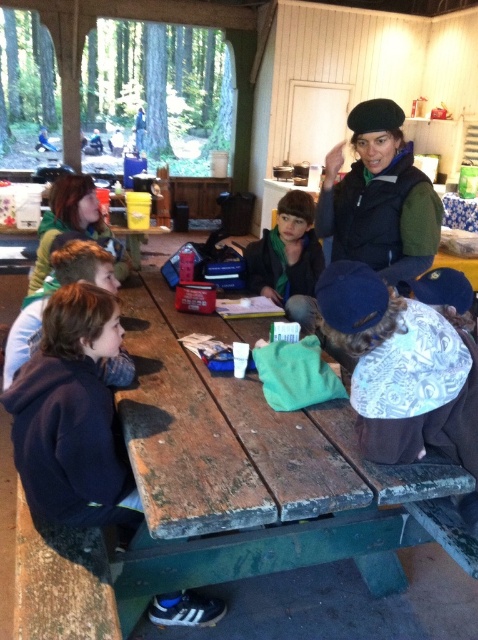
Question: Does wooden picnic table at center appear on the left side of dark blue hoodie at lower left?

Choices:
 (A) yes
 (B) no

Answer: (B)

Question: Which object is farther from the camera taking this photo?

Choices:
 (A) wooden picnic table at center
 (B) dark blue hoodie at lower left

Answer: (B)

Question: Which point is farther to the camera?

Choices:
 (A) wooden picnic table at center
 (B) dark blue hoodie at lower left

Answer: (B)

Question: Can you confirm if wooden picnic table at center is positioned above dark blue hoodie at lower left?

Choices:
 (A) no
 (B) yes

Answer: (B)

Question: Is wooden picnic table at center below dark blue hoodie at lower left?

Choices:
 (A) no
 (B) yes

Answer: (A)